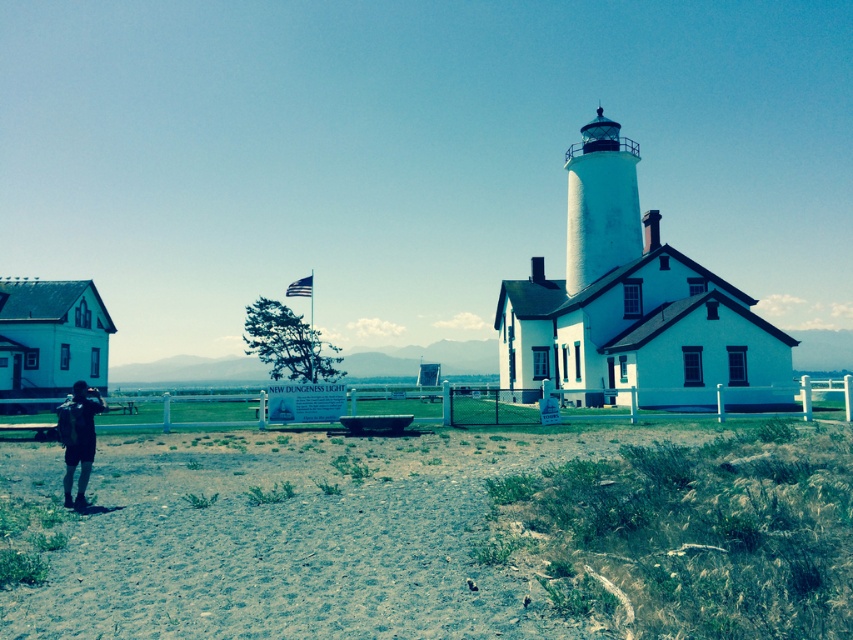
Is dirt/gritty ground at lower left positioned in front of dark blue jeans at lower left?

That is True.

Identify the location of dirt/gritty ground at lower left. (438, 534).